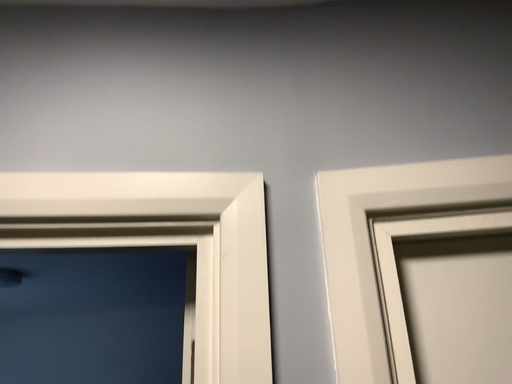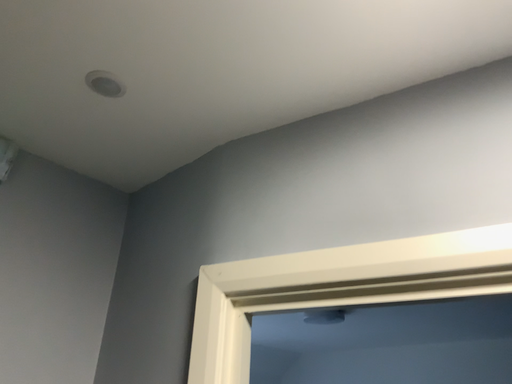
Question: Which way did the camera rotate in the video?

Choices:
 (A) rotated right
 (B) rotated left

Answer: (B)